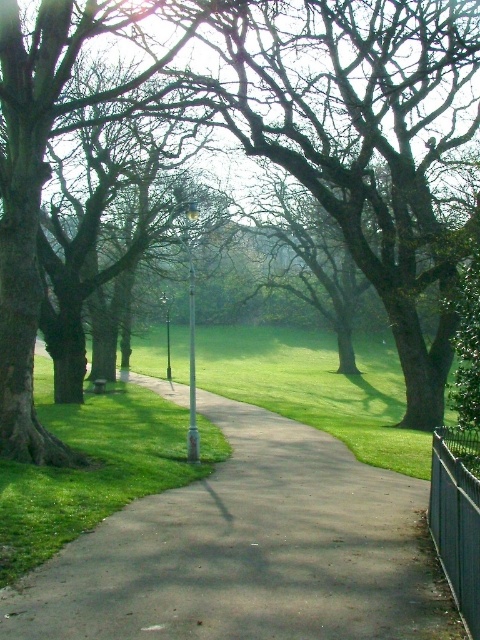
Question: Is smooth bark tree at center smaller than black metal fence at right?

Choices:
 (A) yes
 (B) no

Answer: (B)

Question: Does black metal fence at right lie behind metallic pole at center?

Choices:
 (A) yes
 (B) no

Answer: (B)

Question: Is smooth bark tree at center thinner than black metal fence at right?

Choices:
 (A) no
 (B) yes

Answer: (A)

Question: Which object is the closest to the smooth bark tree at center?

Choices:
 (A) metallic pole at center
 (B) smooth asphalt path at center
 (C) green metallic pole at center

Answer: (C)

Question: Which of the following is the farthest from the observer?

Choices:
 (A) (188, 435)
 (B) (446, 44)
 (C) (398, 637)
 (D) (168, 365)

Answer: (D)

Question: Estimate the real-world distances between objects in this image. Which object is closer to the green grass at center?

Choices:
 (A) black metal fence at right
 (B) metallic pole at center
 (C) smooth bark tree at center

Answer: (B)